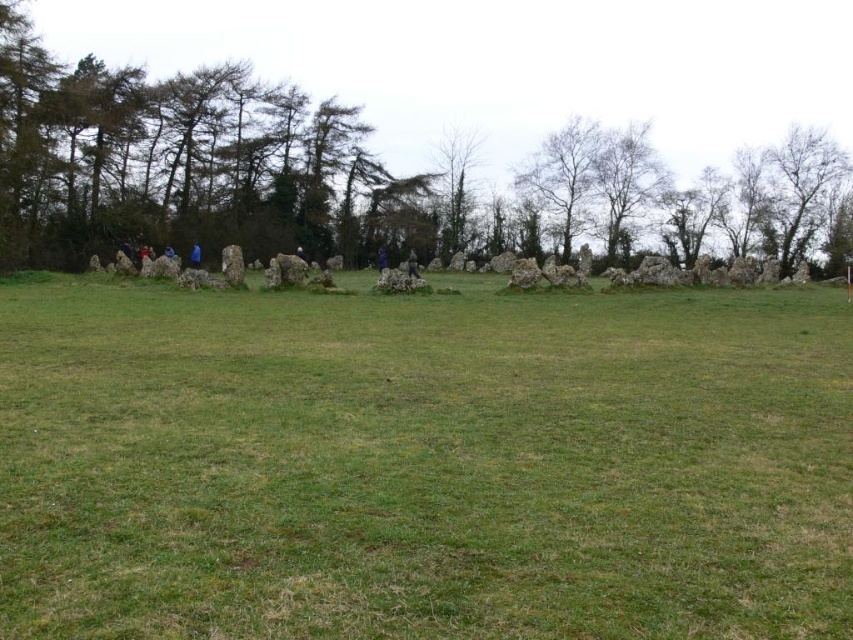
Question: Estimate the real-world distances between objects in this image. Which object is farther from the bare wood tree at upper right?

Choices:
 (A) green leafy tree at upper center
 (B) green grassy field at center

Answer: (B)

Question: In this image, where is green leafy tree at upper center located relative to bare wood tree at upper right?

Choices:
 (A) above
 (B) below

Answer: (A)

Question: Is green grassy field at center positioned behind green leafy tree at upper center?

Choices:
 (A) yes
 (B) no

Answer: (B)

Question: Among these objects, which one is farthest from the camera?

Choices:
 (A) green leafy tree at upper center
 (B) bare wood tree at upper right
 (C) green grassy field at center

Answer: (B)

Question: Which of the following is the closest to the observer?

Choices:
 (A) green grassy field at center
 (B) bare wood tree at upper right

Answer: (A)

Question: Does green grassy field at center have a larger size compared to bare wood tree at upper right?

Choices:
 (A) yes
 (B) no

Answer: (B)